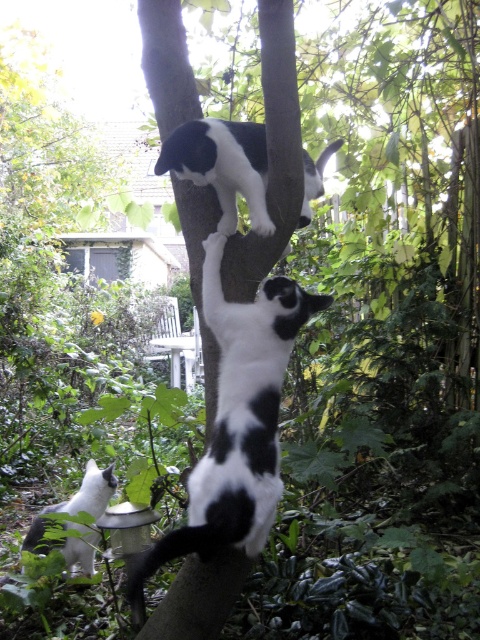
Question: Can you confirm if black and white fur cat at center is smaller than black and white fur cat at upper center?

Choices:
 (A) yes
 (B) no

Answer: (B)

Question: Which object is positioned farthest from the black and white fur cat at upper center?

Choices:
 (A) white soft fur cat at lower left
 (B) black and white fur cat at center

Answer: (A)

Question: Is black and white fur cat at center below black and white fur cat at upper center?

Choices:
 (A) yes
 (B) no

Answer: (A)

Question: Among these points, which one is farthest from the camera?

Choices:
 (A) pos(247,122)
 (B) pos(238,326)
 (C) pos(63,502)

Answer: (C)

Question: Is black and white fur cat at upper center positioned in front of white soft fur cat at lower left?

Choices:
 (A) yes
 (B) no

Answer: (A)

Question: Which is nearer to the black and white fur cat at center?

Choices:
 (A) white soft fur cat at lower left
 (B) black and white fur cat at upper center

Answer: (B)